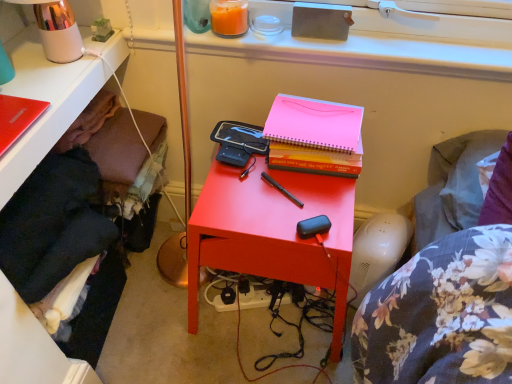
At what (x,y) coordinates should I click in order to perform the action: click on empty space that is to the right of orange wax candle at upper center. Please return your answer as a coordinate pair (x, y). This screenshot has height=384, width=512. Looking at the image, I should click on (273, 34).